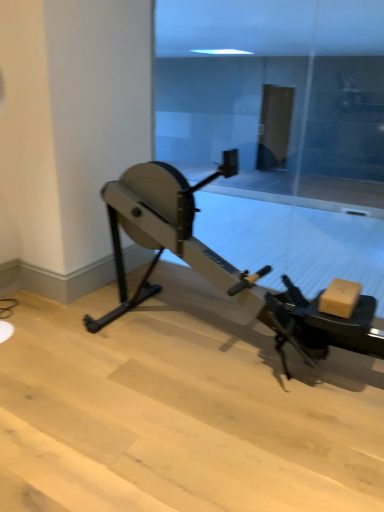
I want to click on vacant region under metallic gray stationary bicycle at center (from a real-world perspective), so click(x=228, y=339).